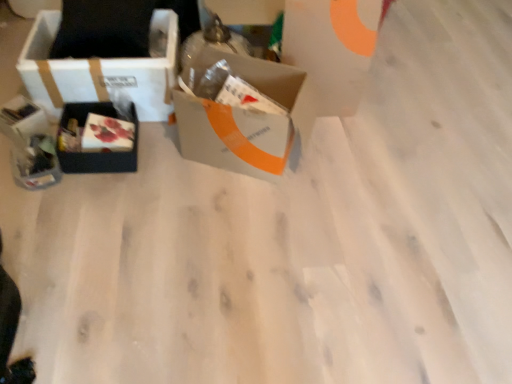
Where is `space that is in front of white cardboard box at left, positioned as the first box in left-to-right order`? Image resolution: width=512 pixels, height=384 pixels. space that is in front of white cardboard box at left, positioned as the first box in left-to-right order is located at coordinates (113, 183).